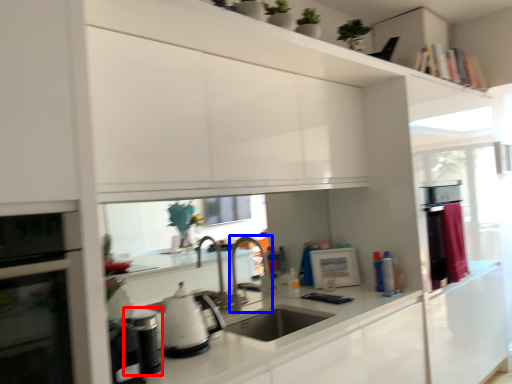
Question: Which point is closer to the camera, appliance (highlighted by a red box) or faucet (highlighted by a blue box)?

Choices:
 (A) appliance
 (B) faucet

Answer: (A)